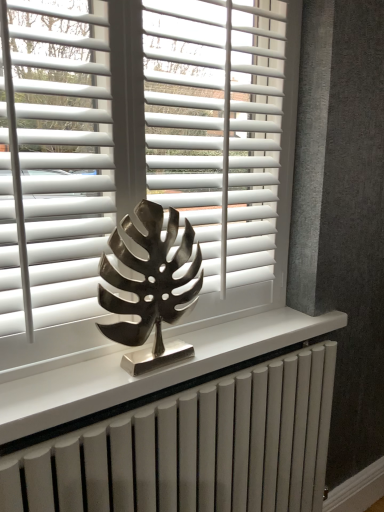
Question: Is white matte blinds at center, which is the 2th blind in left-to-right order, thinner than white matte blinds at center, placed as the first blind when sorted from left to right?

Choices:
 (A) yes
 (B) no

Answer: (B)

Question: Can you confirm if white matte blinds at center, which ranks as the 1th blind in right-to-left order, is positioned to the right of white matte blinds at center, placed as the first blind when sorted from left to right?

Choices:
 (A) no
 (B) yes

Answer: (B)

Question: Does white matte blinds at center, which is the 2th blind in left-to-right order, have a smaller size compared to white matte blinds at center, which is the 2th blind in right-to-left order?

Choices:
 (A) no
 (B) yes

Answer: (A)

Question: From a real-world perspective, does white matte blinds at center, which is the 2th blind in left-to-right order, sit lower than white matte blinds at center, which is the 2th blind in right-to-left order?

Choices:
 (A) yes
 (B) no

Answer: (B)

Question: Is the position of white matte blinds at center, which is the 2th blind in left-to-right order, more distant than that of white matte blinds at center, which is the 2th blind in right-to-left order?

Choices:
 (A) no
 (B) yes

Answer: (B)

Question: Considering the relative sizes of white matte blinds at center, which is the 2th blind in left-to-right order, and white matte blinds at center, which is the 2th blind in right-to-left order, in the image provided, is white matte blinds at center, which is the 2th blind in left-to-right order, bigger than white matte blinds at center, which is the 2th blind in right-to-left order,?

Choices:
 (A) yes
 (B) no

Answer: (A)

Question: Is white matte blinds at center, which is the 2th blind in left-to-right order, oriented away from white metallic radiator at center?

Choices:
 (A) yes
 (B) no

Answer: (B)

Question: Does white matte blinds at center, which ranks as the 1th blind in right-to-left order, have a lesser height compared to white metallic radiator at center?

Choices:
 (A) yes
 (B) no

Answer: (B)

Question: Can you confirm if white matte blinds at center, which is the 2th blind in left-to-right order, is bigger than white metallic radiator at center?

Choices:
 (A) no
 (B) yes

Answer: (A)

Question: Considering the relative positions of white matte blinds at center, which ranks as the 1th blind in right-to-left order, and white metallic radiator at center in the image provided, is white matte blinds at center, which ranks as the 1th blind in right-to-left order, to the right of white metallic radiator at center from the viewer's perspective?

Choices:
 (A) yes
 (B) no

Answer: (B)

Question: Does white matte blinds at center, which is the 2th blind in left-to-right order, lie behind white metallic radiator at center?

Choices:
 (A) yes
 (B) no

Answer: (A)

Question: Is white matte blinds at center, which is the 2th blind in left-to-right order, thinner than white metallic radiator at center?

Choices:
 (A) no
 (B) yes

Answer: (B)

Question: Is white matte blinds at center, which ranks as the 1th blind in right-to-left order, outside metallic leaf sculpture at center?

Choices:
 (A) no
 (B) yes

Answer: (B)